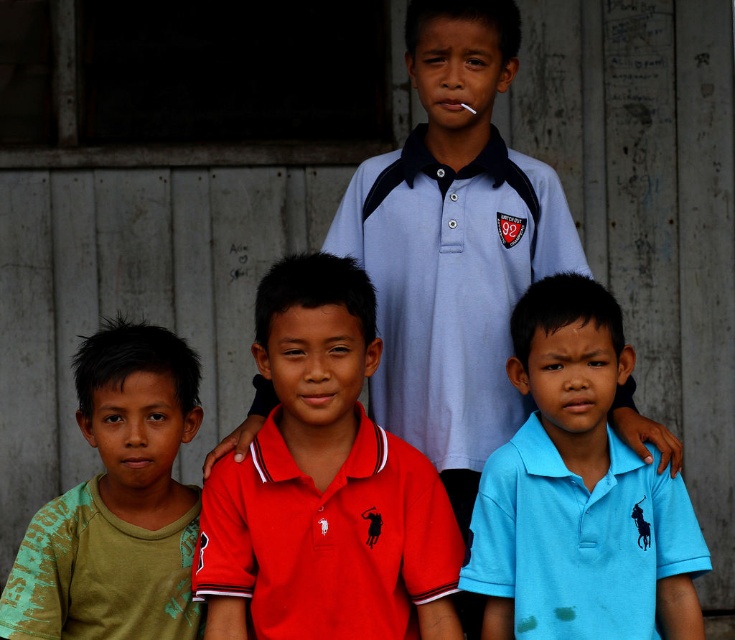
You are a photographer trying to capture a group photo of the boys. You notice the red matte polo shirt at center and the green cotton shirt at lower left. Which boy should you ask to move forward so that both shirts are equally visible in the photo?

You should ask the green cotton shirt at lower left to move forward because the red matte polo shirt at center is larger in size and already occupies more space, so moving the smaller green cotton shirt at lower left closer will help balance their visibility in the photo.

In the scene described, two boys are wearing shirts with similar black logos. The red matte polo shirt at center and the blue cotton shirt at center are positioned in a specific way. From the observer perspective, which shirt is on the left side?

The red matte polo shirt at center is positioned to the left of the blue cotton shirt at center.

Based on the scene description, which object label corresponds to the coordinates point (323,483)?

The coordinates point (323,483) corresponds to the red matte polo shirt at center.